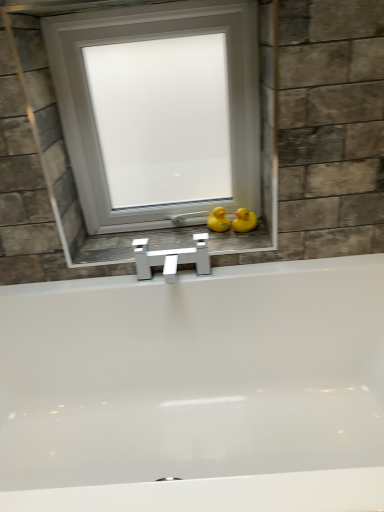
I want to click on vacant space underneath white glossy faucet at center (from a real-world perspective), so click(x=153, y=244).